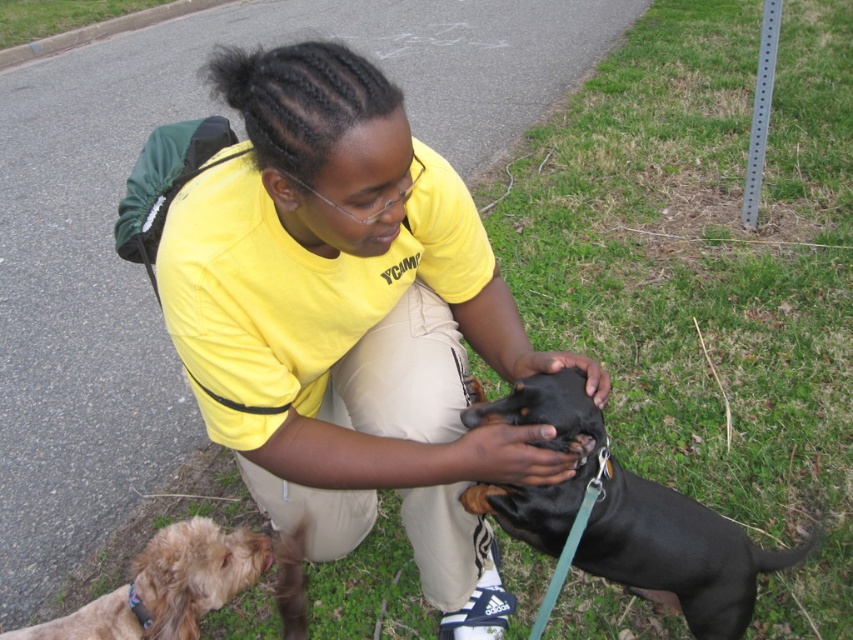
You are a photographer trying to capture the scene. You need to ensure that the yellow cotton shirt at center and the light brown fur at lower left are both visible in the frame. Which object should you prioritize framing first to ensure both are visible, considering their sizes?

The yellow cotton shirt at center is wider than the light brown fur at lower left. To ensure both are visible in the frame, prioritize framing the wider object first, which is the yellow cotton shirt at center, then adjust to include the smaller light brown fur at lower left.

The scene has a person interacting with two dogs in a grassy area. The dogs are the black smooth dog at center and the small light brown dog at lower right. The person is wearing a yellow T shirt with YCM on it. A point at coordinates (677,552) is on the black smooth dog at center. If the person wants to move the point to the small light brown dog at lower right, which direction should they move it?

The person should move the point at coordinates (677,552) towards the small light brown dog at lower right, which is located at a lower right position compared to the black smooth dog at center.

You are a photographer trying to capture a clear photo of the black smooth dog at center and the light brown fur at lower left. Which dog should you focus on first to ensure both are in focus?

The black smooth dog at center is in front of the light brown fur at lower left, so you should focus on the black smooth dog at center first to ensure both are in focus.